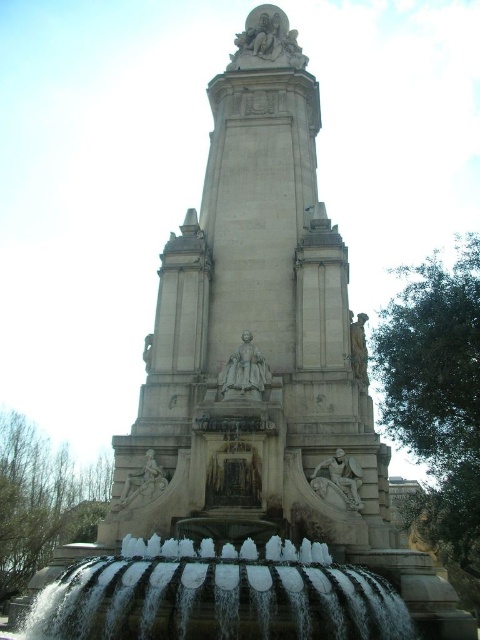
The width and height of the screenshot is (480, 640). What do you see at coordinates (216, 595) in the screenshot?
I see `white frothy water at center` at bounding box center [216, 595].

Which is below, white frothy water at center or white marble statue at lower center?

white frothy water at center is lower down.

What are the coordinates of `white frothy water at center` in the screenshot? It's located at (216, 595).

Does gray stone statue at center have a greater width compared to white marble statue at lower center?

Yes, gray stone statue at center is wider than white marble statue at lower center.

Is point (232, 384) in front of point (149, 452)?

No, (232, 384) is further to viewer.

This screenshot has height=640, width=480. In order to click on gray stone statue at center in this screenshot , I will do `click(244, 371)`.

Does white frothy water at center come behind white marble relief at center?

No, it is not.

Does white frothy water at center have a smaller size compared to white marble relief at center?

No, white frothy water at center is not smaller than white marble relief at center.

I want to click on white frothy water at center, so click(x=216, y=595).